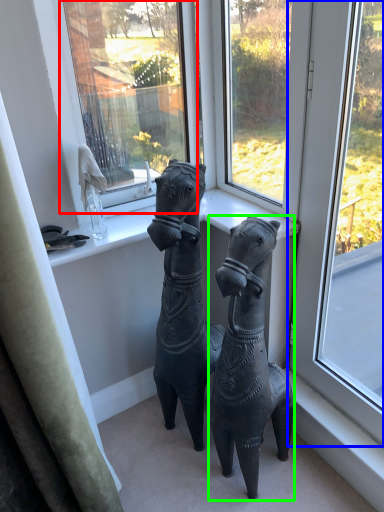
Question: Considering the real-world distances, which object is farthest from window screen (highlighted by a red box)? window (highlighted by a blue box) or horse (highlighted by a green box)?

Choices:
 (A) window
 (B) horse

Answer: (B)